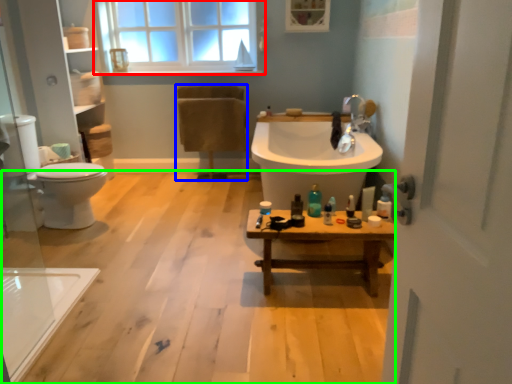
Question: Which object is the closest to the window (highlighted by a red box)? Choose among these: chair (highlighted by a blue box) or plain (highlighted by a green box).

Choices:
 (A) chair
 (B) plain

Answer: (A)